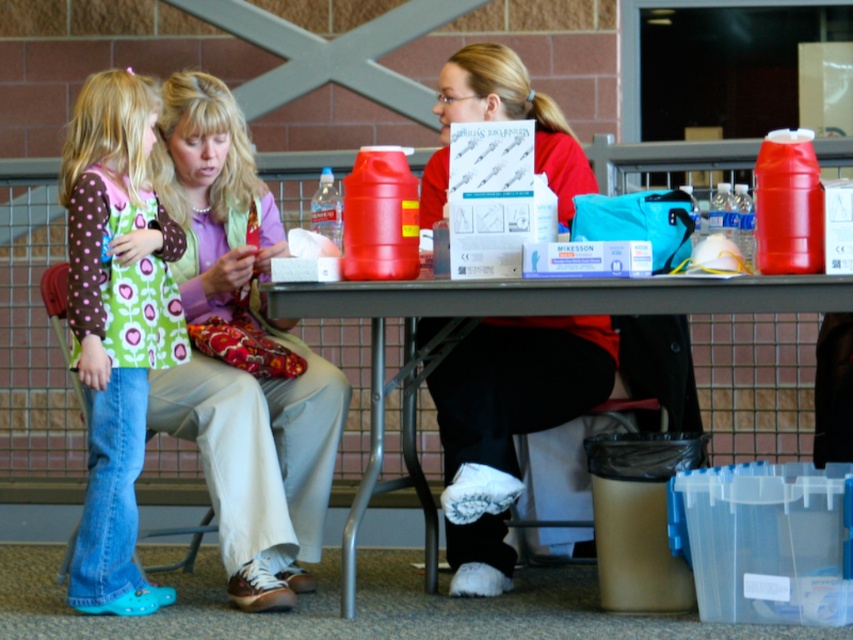
Does polka dot fabric dress at lower left have a lesser height compared to metallic gray table at center?

In fact, polka dot fabric dress at lower left may be taller than metallic gray table at center.

In order to click on polka dot fabric dress at lower left in this screenshot , I will do point(115,323).

Describe the element at coordinates (115, 323) in the screenshot. I see `polka dot fabric dress at lower left` at that location.

Where is `polka dot fabric dress at lower left`? This screenshot has height=640, width=853. polka dot fabric dress at lower left is located at coordinates (115, 323).

Who is more distant from viewer, (309, 451) or (608, 388)?

Point (309, 451)

The width and height of the screenshot is (853, 640). What do you see at coordinates (235, 365) in the screenshot?
I see `matte purple sweater at center` at bounding box center [235, 365].

Image resolution: width=853 pixels, height=640 pixels. What do you see at coordinates (235, 365) in the screenshot?
I see `matte purple sweater at center` at bounding box center [235, 365].

Find the location of a particular element. The image size is (853, 640). matte purple sweater at center is located at coordinates (235, 365).

Is matte purple sweater at center below metallic gray table at center?

No.

In the scene shown: Between matte purple sweater at center and metallic gray table at center, which one has less height?

metallic gray table at center

Describe the element at coordinates (235, 365) in the screenshot. This screenshot has width=853, height=640. I see `matte purple sweater at center` at that location.

At what (x,y) coordinates should I click in order to perform the action: click on matte purple sweater at center. Please return your answer as a coordinate pair (x, y). The image size is (853, 640). Looking at the image, I should click on (235, 365).